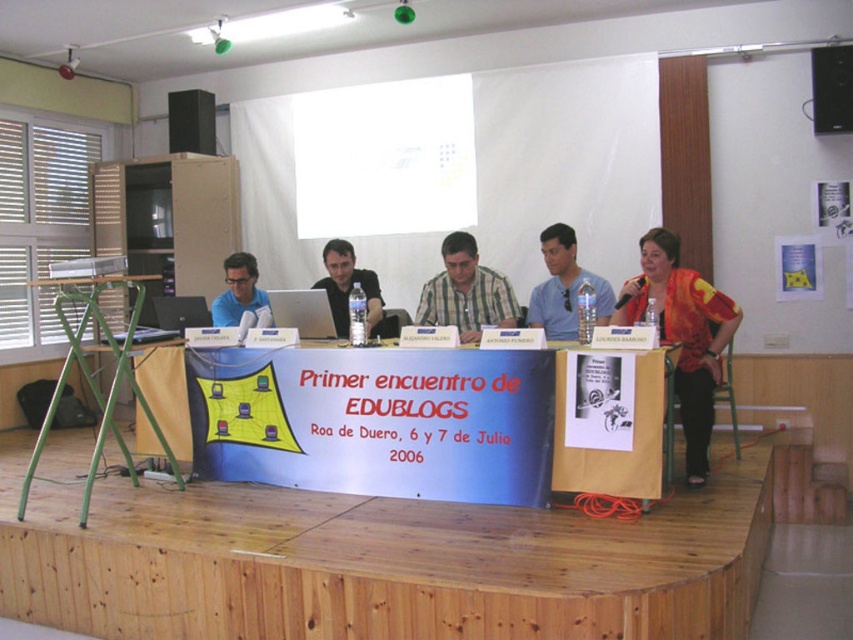
You are an attendee at the panel discussion and need to place a notebook on the green metal table at left. Based on the coordinates provided, where exactly should you place the notebook on the table?

The green metal table at left is located at point (96,372), so you should place the notebook at those coordinates on the table.